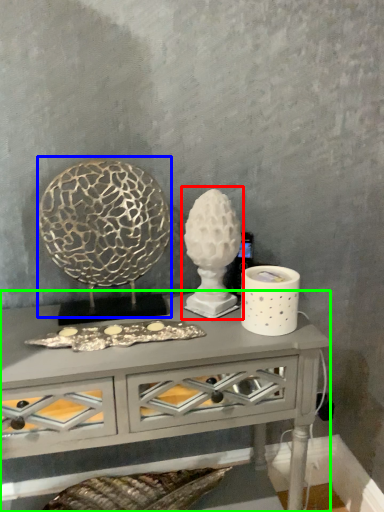
Question: Estimate the real-world distances between objects in this image. Which object is farther from sculpture (highlighted by a red box), sculpture (highlighted by a blue box) or table (highlighted by a green box)?

Choices:
 (A) sculpture
 (B) table

Answer: (B)